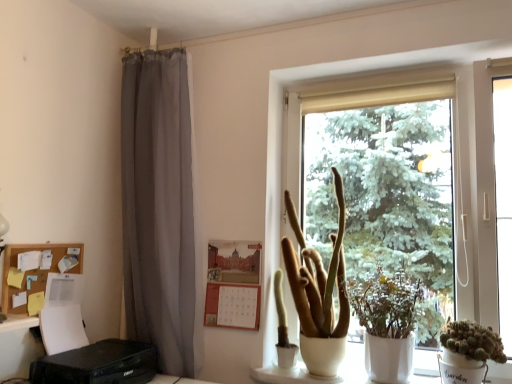
Where is `vacant point above white matte window at center (from a real-world perspective)`? The height and width of the screenshot is (384, 512). vacant point above white matte window at center (from a real-world perspective) is located at coordinates (398, 59).